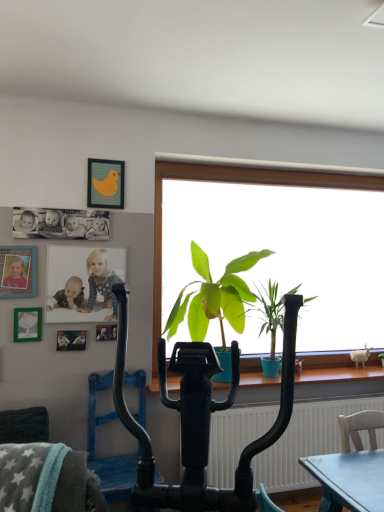
Question: Which direction should I rotate to face matte yellow bird at upper center, which ranks as the first picture frame in top-to-bottom order, — up or down?

Choices:
 (A) up
 (B) down

Answer: (A)

Question: Is black rubber vacuum at center far from gray plush swivel chair at lower left?

Choices:
 (A) yes
 (B) no

Answer: (B)

Question: Considering the relative positions of black rubber vacuum at center and gray plush swivel chair at lower left in the image provided, is black rubber vacuum at center in front of gray plush swivel chair at lower left?

Choices:
 (A) yes
 (B) no

Answer: (B)

Question: Is black rubber vacuum at center behind gray plush swivel chair at lower left?

Choices:
 (A) yes
 (B) no

Answer: (A)

Question: Is black rubber vacuum at center to the right of gray plush swivel chair at lower left from the viewer's perspective?

Choices:
 (A) no
 (B) yes

Answer: (B)

Question: Is black rubber vacuum at center taller than gray plush swivel chair at lower left?

Choices:
 (A) no
 (B) yes

Answer: (B)

Question: From the image's perspective, is black rubber vacuum at center under gray plush swivel chair at lower left?

Choices:
 (A) yes
 (B) no

Answer: (A)

Question: Is black matte photograph at upper left oriented away from matte white photo of children at upper left?

Choices:
 (A) yes
 (B) no

Answer: (B)

Question: Considering the relative positions of black matte photograph at upper left and matte white photo of children at upper left in the image provided, is black matte photograph at upper left to the left of matte white photo of children at upper left from the viewer's perspective?

Choices:
 (A) yes
 (B) no

Answer: (A)

Question: Can you confirm if black matte photograph at upper left is wider than matte white photo of children at upper left?

Choices:
 (A) no
 (B) yes

Answer: (B)

Question: Is black matte photograph at upper left located outside matte white photo of children at upper left?

Choices:
 (A) no
 (B) yes

Answer: (B)

Question: From a real-world perspective, is black matte photograph at upper left below matte white photo of children at upper left?

Choices:
 (A) no
 (B) yes

Answer: (A)

Question: Considering the relative sizes of black matte photograph at upper left and matte white photo of children at upper left in the image provided, is black matte photograph at upper left shorter than matte white photo of children at upper left?

Choices:
 (A) no
 (B) yes

Answer: (B)

Question: From a real-world perspective, does black rubber vacuum at center sit lower than metallic silver picture frame at left, which ranks as the 4th picture frame in right-to-left order?

Choices:
 (A) no
 (B) yes

Answer: (B)